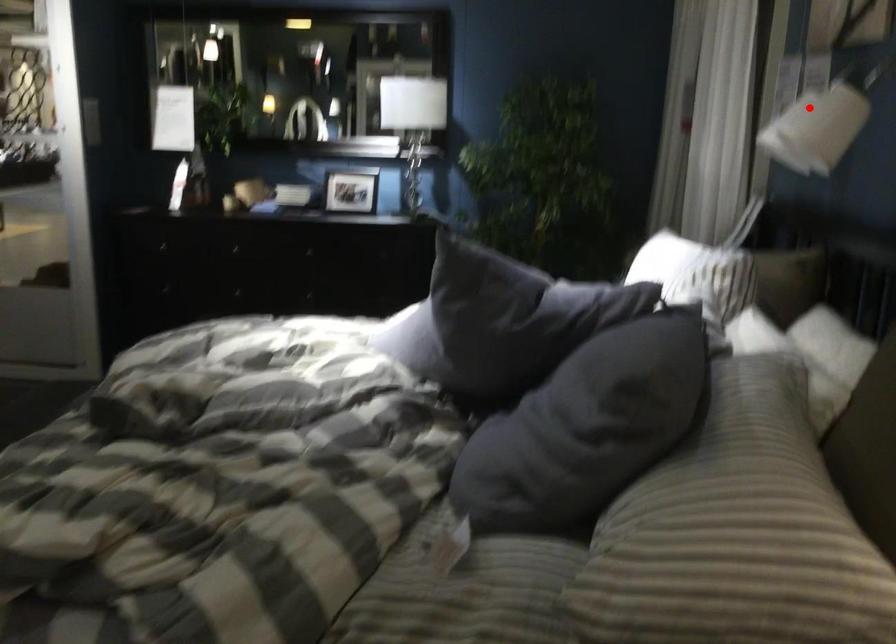
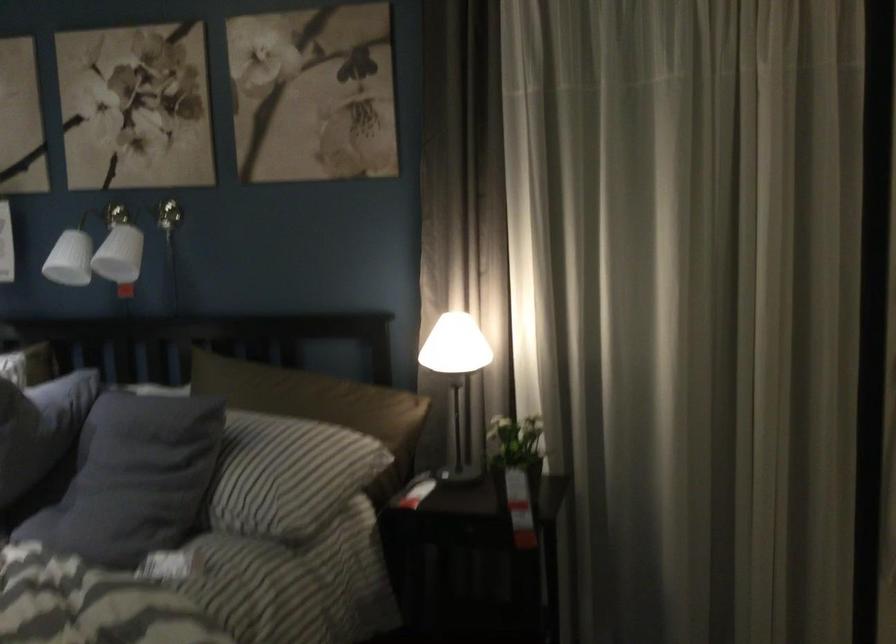
Question: I am providing you with two images of the same scene from different viewpoints. Image1 has a red point marked. In image2, the corresponding 3D location appears at what relative position? Reply with the corresponding letter.

Choices:
 (A) Closer
 (B) Farther

Answer: (B)